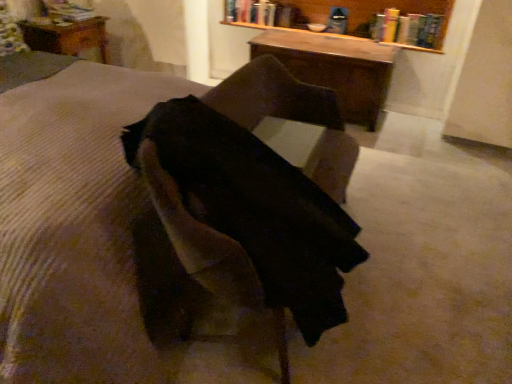
Question: Considering the positions of suede-like brown chair at center and wooden table at upper left, which appears as the first table when viewed from the left, in the image, is suede-like brown chair at center taller or shorter than wooden table at upper left, which appears as the first table when viewed from the left,?

Choices:
 (A) short
 (B) tall

Answer: (B)

Question: Considering the positions of suede-like brown chair at center and wooden table at upper left, which appears as the first table when viewed from the left, in the image, is suede-like brown chair at center wider or thinner than wooden table at upper left, which appears as the first table when viewed from the left,?

Choices:
 (A) wide
 (B) thin

Answer: (A)

Question: Estimate the real-world distances between objects in this image. Which object is farther from the wooden bookshelf at upper center?

Choices:
 (A) black fabric at center, acting as the 2th table starting from the right
 (B) wooden table at center, marked as the 2th table in a back-to-front arrangement
 (C) hardcover book at upper left, placed as the first book when sorted from left to right
 (D) hardcover book at upper center, the third book in the left-to-right sequence
 (E) suede-like brown chair at center

Answer: (E)

Question: Which object is the closest to the black fabric at center, acting as the 2th table starting from the right?

Choices:
 (A) hardcover book at upper center, the third book in the left-to-right sequence
 (B) suede-like brown chair at center
 (C) brown corduroy mattress at center
 (D) wooden table at upper left, acting as the 3th table starting from the front
 (E) wooden table at center, positioned as the 1th table in right-to-left order

Answer: (B)